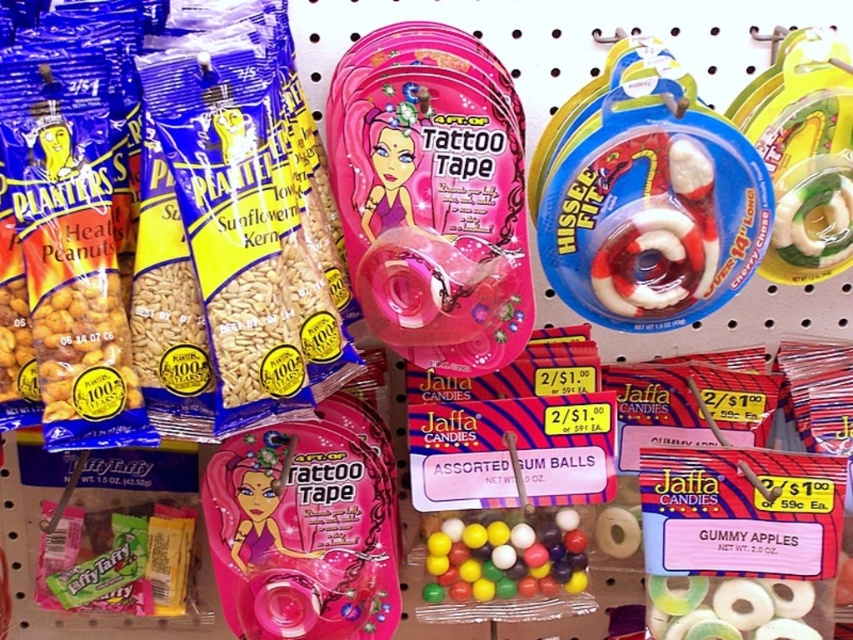
Question: Can you confirm if pink plastic tattoo tape at center is bigger than gummy translucent rings at center?

Choices:
 (A) no
 (B) yes

Answer: (B)

Question: Which of the following is the closest to the observer?

Choices:
 (A) translucent plastic toy at right
 (B) gummy translucent rings at center

Answer: (A)

Question: Which is farther from the white rubber ring at right?

Choices:
 (A) pink plastic tattoo tape at center
 (B) glossy plastic gum balls at center
 (C) gummy translucent rings at center
 (D) translucent plastic toy at right

Answer: (C)

Question: Can you confirm if translucent plastic toy at right is positioned to the left of glossy plastic gum balls at center?

Choices:
 (A) no
 (B) yes

Answer: (A)

Question: Is pink plastic tattoo tape at center to the right of glossy plastic gum balls at center from the viewer's perspective?

Choices:
 (A) yes
 (B) no

Answer: (B)

Question: Which point is farther to the camera?

Choices:
 (A) gummy translucent rings at center
 (B) translucent plastic toy at right
 (C) white rubber ring at right

Answer: (A)